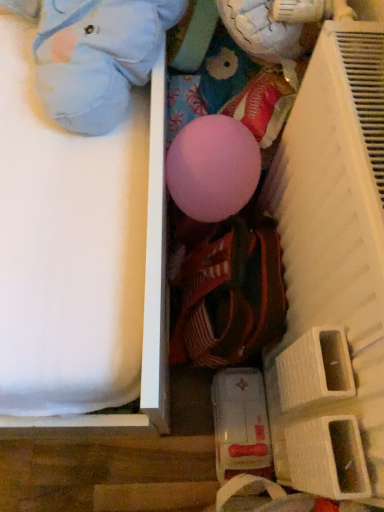
Question: Can you confirm if light blue plush toy at upper left is smaller than white plastic shelf at right?

Choices:
 (A) no
 (B) yes

Answer: (B)

Question: Is light blue plush toy at upper left facing away from white plastic shelf at right?

Choices:
 (A) no
 (B) yes

Answer: (A)

Question: Is light blue plush toy at upper left to the right of white plastic shelf at right from the viewer's perspective?

Choices:
 (A) no
 (B) yes

Answer: (A)

Question: Is light blue plush toy at upper left oriented towards white plastic shelf at right?

Choices:
 (A) no
 (B) yes

Answer: (A)

Question: From the image's perspective, is light blue plush toy at upper left on white plastic shelf at right?

Choices:
 (A) no
 (B) yes

Answer: (B)

Question: Is white plastic shelf at right a part of light blue plush toy at upper left?

Choices:
 (A) yes
 (B) no

Answer: (B)

Question: Does white plastic shelf at right have a greater width compared to light blue plush toy at upper left?

Choices:
 (A) yes
 (B) no

Answer: (B)

Question: From the image's perspective, is white plastic shelf at right over light blue plush toy at upper left?

Choices:
 (A) yes
 (B) no

Answer: (B)

Question: Does white plastic shelf at right contain light blue plush toy at upper left?

Choices:
 (A) yes
 (B) no

Answer: (B)

Question: Does white plastic shelf at right appear on the right side of light blue plush toy at upper left?

Choices:
 (A) no
 (B) yes

Answer: (B)

Question: Is white plastic shelf at right outside light blue plush toy at upper left?

Choices:
 (A) no
 (B) yes

Answer: (B)

Question: Is white plastic shelf at right smaller than light blue plush toy at upper left?

Choices:
 (A) yes
 (B) no

Answer: (B)

Question: Looking at their shapes, would you say white plastic shelf at right is wider or thinner than light blue plush toy at upper left?

Choices:
 (A) wide
 (B) thin

Answer: (B)